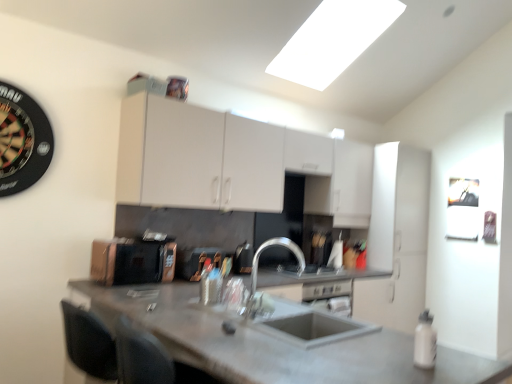
Question: Does metallic silver toaster at center, which ranks as the 2th appliance in right-to-left order, appear on the left side of white matte bottle at lower right?

Choices:
 (A) no
 (B) yes

Answer: (B)

Question: Could you tell me if metallic silver toaster at center, which ranks as the 2th appliance in right-to-left order, is turned towards white matte bottle at lower right?

Choices:
 (A) no
 (B) yes

Answer: (B)

Question: From the image's perspective, is metallic silver toaster at center, which ranks as the 2th appliance in right-to-left order, on top of white matte bottle at lower right?

Choices:
 (A) yes
 (B) no

Answer: (A)

Question: Does metallic silver toaster at center, the 2th appliance in the left-to-right sequence, have a larger size compared to white matte bottle at lower right?

Choices:
 (A) yes
 (B) no

Answer: (A)

Question: From the image's perspective, relative to white matte cabinet at center, the 1th cabinetry from the right, is white matte cabinet at upper center, the 1th cabinetry from the left, above or below?

Choices:
 (A) below
 (B) above

Answer: (B)

Question: From a real-world perspective, is white matte cabinet at upper center, the second cabinetry positioned from the right, positioned above or below white matte cabinet at center, the 1th cabinetry from the right?

Choices:
 (A) above
 (B) below

Answer: (A)

Question: Choose the correct answer: Is white matte cabinet at upper center, the 1th cabinetry from the left, inside white matte cabinet at center, the 1th cabinetry from the right, or outside it?

Choices:
 (A) inside
 (B) outside

Answer: (B)

Question: Would you say white matte cabinet at upper center, the 1th cabinetry from the left, is to the left or to the right of white matte cabinet at center, which is counted as the 2th cabinetry, starting from the left, in the picture?

Choices:
 (A) left
 (B) right

Answer: (A)

Question: In terms of width, does concrete gray countertop at center look wider or thinner when compared to satin silver gas stove at center?

Choices:
 (A) wide
 (B) thin

Answer: (A)

Question: From a real-world perspective, relative to satin silver gas stove at center, is concrete gray countertop at center vertically above or below?

Choices:
 (A) below
 (B) above

Answer: (A)

Question: Considering the positions of concrete gray countertop at center and satin silver gas stove at center in the image, is concrete gray countertop at center taller or shorter than satin silver gas stove at center?

Choices:
 (A) short
 (B) tall

Answer: (B)

Question: Based on their positions, is concrete gray countertop at center located to the left or right of satin silver gas stove at center?

Choices:
 (A) right
 (B) left

Answer: (B)

Question: Is concrete gray countertop at center taller or shorter than metallic silver toaster at center, the 2th appliance in the left-to-right sequence?

Choices:
 (A) tall
 (B) short

Answer: (A)

Question: From the image's perspective, is concrete gray countertop at center above or below metallic silver toaster at center, which ranks as the 2th appliance in right-to-left order?

Choices:
 (A) below
 (B) above

Answer: (A)